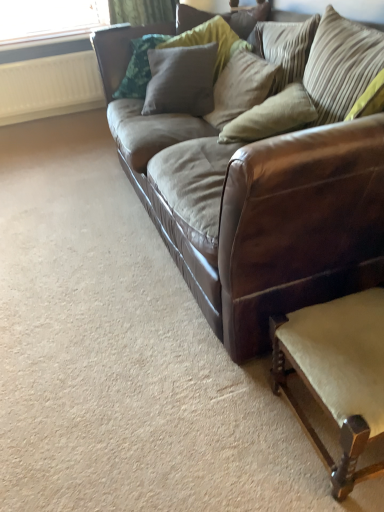
The height and width of the screenshot is (512, 384). What do you see at coordinates (241, 87) in the screenshot?
I see `textured beige pillow at upper center, arranged as the 3th pillow when viewed from the right` at bounding box center [241, 87].

Image resolution: width=384 pixels, height=512 pixels. In order to click on light beige fabric swivel chair at lower right in this screenshot , I will do `click(337, 374)`.

Measure the distance between point (346,262) and camera.

The depth of point (346,262) is 1.23 meters.

Where is `textured beige pillow at upper center, which is the 2th pillow in left-to-right order`? This screenshot has width=384, height=512. textured beige pillow at upper center, which is the 2th pillow in left-to-right order is located at coordinates (241, 87).

Is brown leather couch at center bigger than white ribbed radiator at upper left?

Yes.

Is brown leather couch at center taller than white ribbed radiator at upper left?

Yes.

From the image's perspective, is brown leather couch at center located above white ribbed radiator at upper left?

No, from the image's perspective, brown leather couch at center is not on top of white ribbed radiator at upper left.

Is brown leather couch at center at the left side of white ribbed radiator at upper left?

In fact, brown leather couch at center is to the right of white ribbed radiator at upper left.

Consider the image. From the image's perspective, is beige fabric pillow at center, the third pillow positioned from the left, located beneath white ribbed radiator at upper left?

Yes, from the image's perspective, beige fabric pillow at center, the third pillow positioned from the left, is below white ribbed radiator at upper left.

Between beige fabric pillow at center, which is the second pillow from right to left, and white ribbed radiator at upper left, which one has larger width?

beige fabric pillow at center, which is the second pillow from right to left, is wider.

From the picture: How many degrees apart are the facing directions of beige fabric pillow at center, the third pillow positioned from the left, and white ribbed radiator at upper left?

They differ by 109 degrees in their facing directions.

Based on the photo, does beige fabric pillow at center, which is the second pillow from right to left, touch white ribbed radiator at upper left?

No, beige fabric pillow at center, which is the second pillow from right to left, is not next to white ribbed radiator at upper left.

Considering the relative positions of textured gray pillow at upper center, arranged as the 1th pillow when viewed from the left, and light beige fabric swivel chair at lower right in the image provided, is textured gray pillow at upper center, arranged as the 1th pillow when viewed from the left, behind light beige fabric swivel chair at lower right?

Yes, it is.

Based on the photo, is textured gray pillow at upper center, arranged as the 1th pillow when viewed from the left, in contact with light beige fabric swivel chair at lower right?

No, textured gray pillow at upper center, arranged as the 1th pillow when viewed from the left, is not touching light beige fabric swivel chair at lower right.

Consider the image. Is textured gray pillow at upper center, the 4th pillow from the right, aimed at light beige fabric swivel chair at lower right?

No, textured gray pillow at upper center, the 4th pillow from the right, is not aimed at light beige fabric swivel chair at lower right.

From a real-world perspective, is textured gray pillow at upper center, the 4th pillow from the right, below light beige fabric swivel chair at lower right?

Actually, textured gray pillow at upper center, the 4th pillow from the right, is physically above light beige fabric swivel chair at lower right in the real world.

Considering the relative sizes of textured beige pillow at upper center, arranged as the 3th pillow when viewed from the right, and striped fabric pillow at upper right, placed as the 1th pillow when sorted from right to left, in the image provided, is textured beige pillow at upper center, arranged as the 3th pillow when viewed from the right, wider than striped fabric pillow at upper right, placed as the 1th pillow when sorted from right to left,?

Correct, the width of textured beige pillow at upper center, arranged as the 3th pillow when viewed from the right, exceeds that of striped fabric pillow at upper right, placed as the 1th pillow when sorted from right to left.

Does textured beige pillow at upper center, arranged as the 3th pillow when viewed from the right, have a larger size compared to striped fabric pillow at upper right, placed as the 1th pillow when sorted from right to left?

Yes.

Considering the sizes of objects textured beige pillow at upper center, which is the 2th pillow in left-to-right order, and striped fabric pillow at upper right, placed as the 1th pillow when sorted from right to left, in the image provided, who is shorter, textured beige pillow at upper center, which is the 2th pillow in left-to-right order, or striped fabric pillow at upper right, placed as the 1th pillow when sorted from right to left,?

With less height is striped fabric pillow at upper right, placed as the 1th pillow when sorted from right to left.

How far apart are textured beige pillow at upper center, arranged as the 3th pillow when viewed from the right, and striped fabric pillow at upper right, the fourth pillow positioned from the left?

textured beige pillow at upper center, arranged as the 3th pillow when viewed from the right, is 5.26 inches from striped fabric pillow at upper right, the fourth pillow positioned from the left.

Does point (236, 108) come closer to viewer compared to point (132, 101)?

Yes, it is in front of point (132, 101).

Does textured beige pillow at upper center, which is the 2th pillow in left-to-right order, turn towards brown leather couch at center?

Yes, textured beige pillow at upper center, which is the 2th pillow in left-to-right order, is facing brown leather couch at center.

How different are the orientations of textured beige pillow at upper center, arranged as the 3th pillow when viewed from the right, and brown leather couch at center in degrees?

They differ by 0.893 degrees in their facing directions.

Which object is closer to the camera taking this photo, textured beige pillow at upper center, arranged as the 3th pillow when viewed from the right, or brown leather couch at center?

brown leather couch at center is in front.

Is brown leather couch at center positioned before striped fabric pillow at upper right, placed as the 1th pillow when sorted from right to left?

Yes, brown leather couch at center is closer to the viewer.

From the picture: What's the angular difference between brown leather couch at center and striped fabric pillow at upper right, the fourth pillow positioned from the left,'s facing directions?

They differ by 0.00324 degrees in their facing directions.

Between brown leather couch at center and striped fabric pillow at upper right, placed as the 1th pillow when sorted from right to left, which one has smaller width?

striped fabric pillow at upper right, placed as the 1th pillow when sorted from right to left.

Does brown leather couch at center appear on the left side of striped fabric pillow at upper right, placed as the 1th pillow when sorted from right to left?

Yes, brown leather couch at center is to the left of striped fabric pillow at upper right, placed as the 1th pillow when sorted from right to left.

Which object is positioned more to the left, striped fabric pillow at upper right, the fourth pillow positioned from the left, or white ribbed radiator at upper left?

Result: white ribbed radiator at upper left is more to the left.

Which is in front, point (280, 53) or point (84, 88)?

The point (280, 53) is closer to the camera.

The width and height of the screenshot is (384, 512). Find the location of `radiator on the left of striped fabric pillow at upper right, the fourth pillow positioned from the left`. radiator on the left of striped fabric pillow at upper right, the fourth pillow positioned from the left is located at coordinates (49, 87).

From the image's perspective, is striped fabric pillow at upper right, the fourth pillow positioned from the left, over white ribbed radiator at upper left?

No, from the image's perspective, striped fabric pillow at upper right, the fourth pillow positioned from the left, is not on top of white ribbed radiator at upper left.

There is a white ribbed radiator at upper left. Find the location of `studio couch above it (from a real-world perspective)`. studio couch above it (from a real-world perspective) is located at coordinates (263, 181).

At what (x,y) coordinates should I click in order to perform the action: click on radiator behind the beige fabric pillow at center, which is the second pillow from right to left. Please return your answer as a coordinate pair (x, y). The image size is (384, 512). Looking at the image, I should click on (49, 87).

When comparing their distances from brown leather couch at center, does white ribbed radiator at upper left or light beige fabric swivel chair at lower right seem further?

white ribbed radiator at upper left lies further to brown leather couch at center than the other object.

Looking at the image, which one is located closer to light beige fabric swivel chair at lower right, striped fabric pillow at upper right, the fourth pillow positioned from the left, or beige fabric pillow at center, the third pillow positioned from the left?

The object closer to light beige fabric swivel chair at lower right is beige fabric pillow at center, the third pillow positioned from the left.

Estimate the real-world distances between objects in this image. Which object is further from textured gray pillow at upper center, arranged as the 1th pillow when viewed from the left, beige fabric pillow at center, the third pillow positioned from the left, or striped fabric pillow at upper right, the fourth pillow positioned from the left?

The object further to textured gray pillow at upper center, arranged as the 1th pillow when viewed from the left, is beige fabric pillow at center, the third pillow positioned from the left.

Considering their positions, is brown leather couch at center positioned closer to striped fabric pillow at upper right, placed as the 1th pillow when sorted from right to left, than white ribbed radiator at upper left?

brown leather couch at center lies closer to striped fabric pillow at upper right, placed as the 1th pillow when sorted from right to left, than the other object.

Which object lies further to the anchor point white ribbed radiator at upper left, striped fabric pillow at upper right, the fourth pillow positioned from the left, or brown leather couch at center?

Among the two, striped fabric pillow at upper right, the fourth pillow positioned from the left, is located further to white ribbed radiator at upper left.

Which object lies nearer to the anchor point white ribbed radiator at upper left, textured gray pillow at upper center, the 4th pillow from the right, or light beige fabric swivel chair at lower right?

textured gray pillow at upper center, the 4th pillow from the right, is positioned closer to the anchor white ribbed radiator at upper left.

From the image, which object appears to be farther from beige fabric pillow at center, which is the second pillow from right to left, striped fabric pillow at upper right, placed as the 1th pillow when sorted from right to left, or light beige fabric swivel chair at lower right?

The object further to beige fabric pillow at center, which is the second pillow from right to left, is light beige fabric swivel chair at lower right.

Based on the photo, considering their positions, is light beige fabric swivel chair at lower right positioned further to textured beige pillow at upper center, which is the 2th pillow in left-to-right order, than white ribbed radiator at upper left?

Among the two, white ribbed radiator at upper left is located further to textured beige pillow at upper center, which is the 2th pillow in left-to-right order.

Image resolution: width=384 pixels, height=512 pixels. I want to click on pillow between brown leather couch at center and striped fabric pillow at upper right, placed as the 1th pillow when sorted from right to left, in the front-back direction, so click(x=272, y=116).

Image resolution: width=384 pixels, height=512 pixels. Find the location of `swivel chair positioned between brown leather couch at center and textured gray pillow at upper center, arranged as the 1th pillow when viewed from the left, from near to far`. swivel chair positioned between brown leather couch at center and textured gray pillow at upper center, arranged as the 1th pillow when viewed from the left, from near to far is located at coordinates 337,374.

In order to click on pillow that lies between brown leather couch at center and light beige fabric swivel chair at lower right from top to bottom in this screenshot , I will do `click(272, 116)`.

At what (x,y) coordinates should I click in order to perform the action: click on swivel chair between brown leather couch at center and white ribbed radiator at upper left along the z-axis. Please return your answer as a coordinate pair (x, y). The height and width of the screenshot is (512, 384). Looking at the image, I should click on (337, 374).